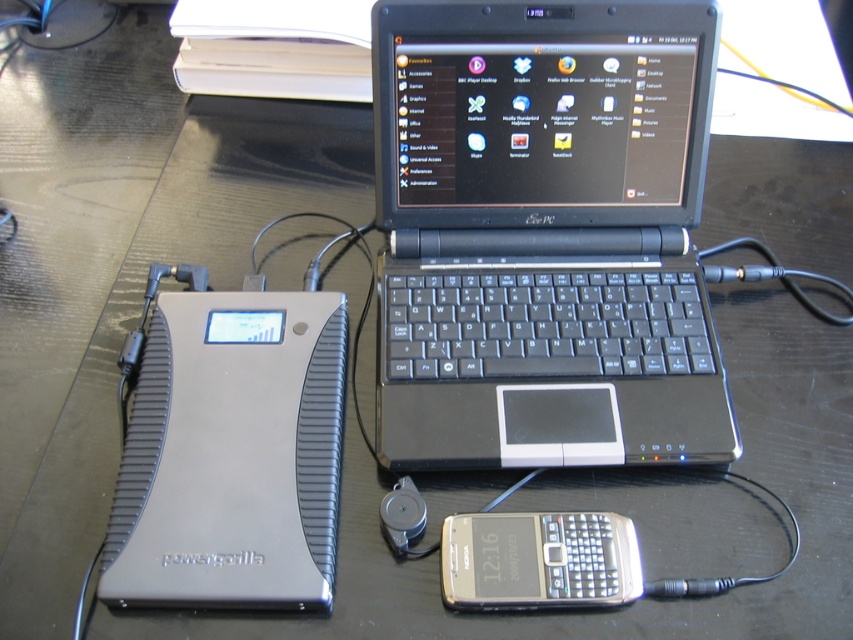
You are looking at the workspace setup. There are two points marked on the image. One is at coordinate point(138,572) and the other is at point(567,536). Which of these two points is closer to you?

Point(138,572) is closer to the viewer than point(567,536).

You are setting up a portable charging station. You have a silver metallic power bank at lower left and a silver metallic smartphone at lower center. Which object has a greater width?

The silver metallic power bank at lower left has a greater width than the silver metallic smartphone at lower center.